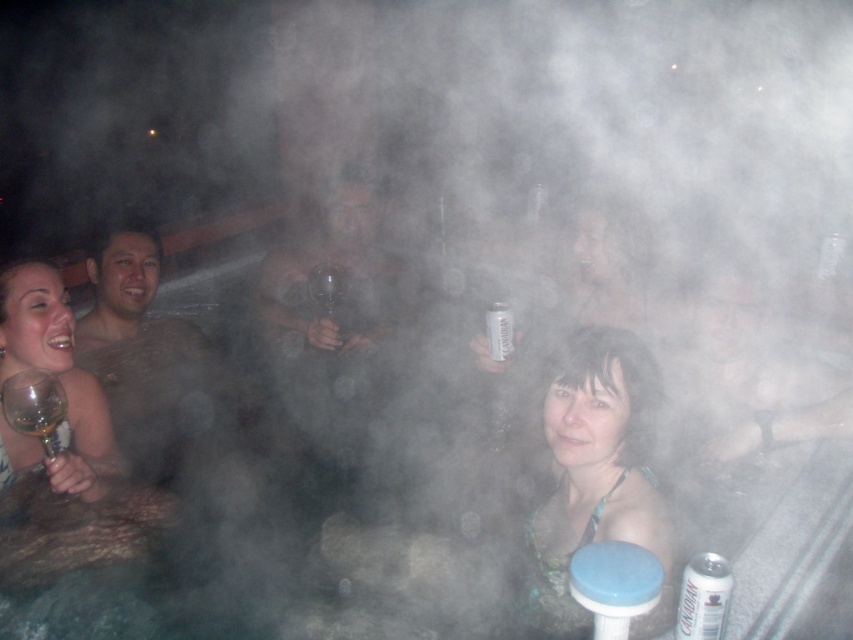
Question: Estimate the real-world distances between objects in this image. Which object is closer to the silver metallic can at center?

Choices:
 (A) matte white wine glass at left
 (B) matte skin at center

Answer: (B)

Question: Does matte green bikini top at center have a greater width compared to silver metallic can at lower right?

Choices:
 (A) no
 (B) yes

Answer: (B)

Question: Which object is closer to the camera taking this photo?

Choices:
 (A) silver metallic can at lower right
 (B) matte white wine glass at left

Answer: (A)

Question: Considering the real-world distances, which object is farthest from the matte green bikini top at center?

Choices:
 (A) matte white wine glass at left
 (B) silver metallic can at lower right

Answer: (A)

Question: Can you confirm if matte white wine glass at left is positioned below translucent glass wine glass at lower left?

Choices:
 (A) no
 (B) yes

Answer: (A)

Question: Is matte skin at center wider than matte white wine glass at left?

Choices:
 (A) no
 (B) yes

Answer: (B)